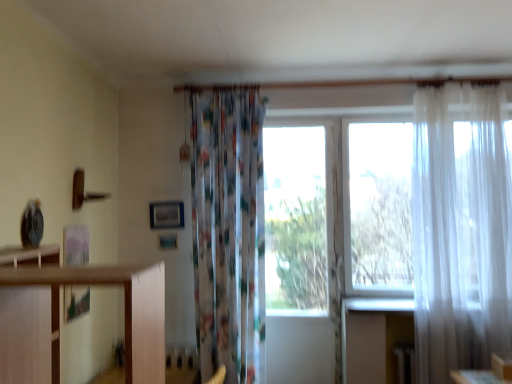
Question: From a real-world perspective, is transparent white curtain at right physically above transparent glass window at center?

Choices:
 (A) yes
 (B) no

Answer: (A)

Question: Would you say transparent white curtain at right contains transparent glass window at center?

Choices:
 (A) no
 (B) yes

Answer: (A)

Question: Does transparent white curtain at right have a greater height compared to transparent glass window at center?

Choices:
 (A) no
 (B) yes

Answer: (A)

Question: Is transparent white curtain at right turned away from transparent glass window at center?

Choices:
 (A) no
 (B) yes

Answer: (A)

Question: Is transparent white curtain at right smaller than transparent glass window at center?

Choices:
 (A) yes
 (B) no

Answer: (B)

Question: Is translucent white curtain at right, the 1th curtain when ordered from right to left, taller or shorter than wooden shelf at left?

Choices:
 (A) short
 (B) tall

Answer: (B)

Question: Looking at their shapes, would you say translucent white curtain at right, the 1th curtain when ordered from right to left, is wider or thinner than wooden shelf at left?

Choices:
 (A) thin
 (B) wide

Answer: (A)

Question: From a real-world perspective, is translucent white curtain at right, which is the 2th curtain from left to right, positioned above or below wooden shelf at left?

Choices:
 (A) below
 (B) above

Answer: (B)

Question: From the image's perspective, relative to wooden shelf at left, is translucent white curtain at right, the 1th curtain when ordered from right to left, above or below?

Choices:
 (A) above
 (B) below

Answer: (A)

Question: From the image's perspective, is transparent glass window at center positioned above or below transparent white curtain at right?

Choices:
 (A) below
 (B) above

Answer: (A)

Question: Considering their positions, is transparent glass window at center located in front of or behind transparent white curtain at right?

Choices:
 (A) behind
 (B) front

Answer: (A)

Question: Considering the positions of point (290, 216) and point (344, 253), is point (290, 216) closer or farther from the camera than point (344, 253)?

Choices:
 (A) farther
 (B) closer

Answer: (A)

Question: Is transparent glass window at center bigger or smaller than transparent white curtain at right?

Choices:
 (A) big
 (B) small

Answer: (B)

Question: Considering the positions of point (421, 349) and point (249, 223), is point (421, 349) closer or farther from the camera than point (249, 223)?

Choices:
 (A) closer
 (B) farther

Answer: (A)

Question: From the image's perspective, is translucent white curtain at right, the 1th curtain when ordered from right to left, positioned above or below printed fabric curtain at center, arranged as the 1th curtain when viewed from the left?

Choices:
 (A) above
 (B) below

Answer: (A)